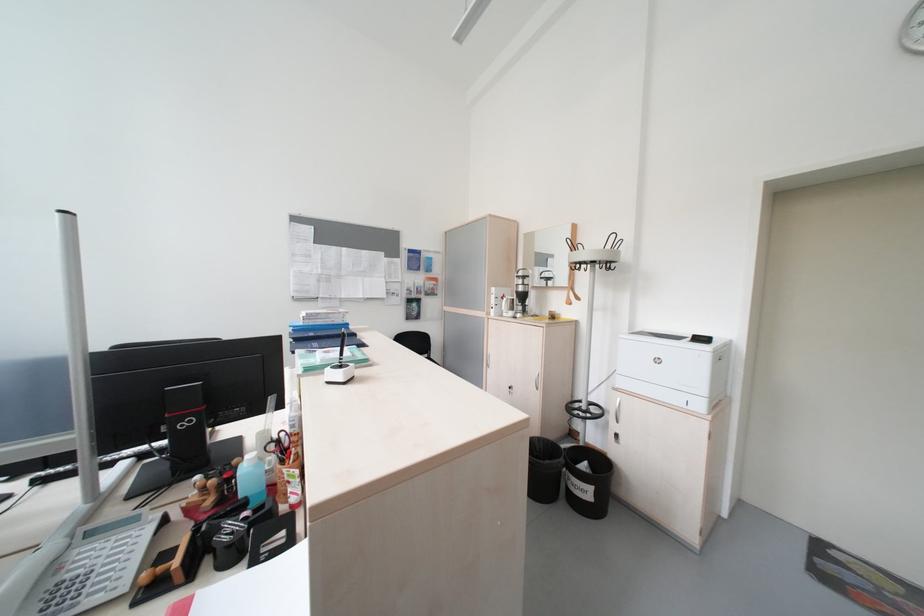
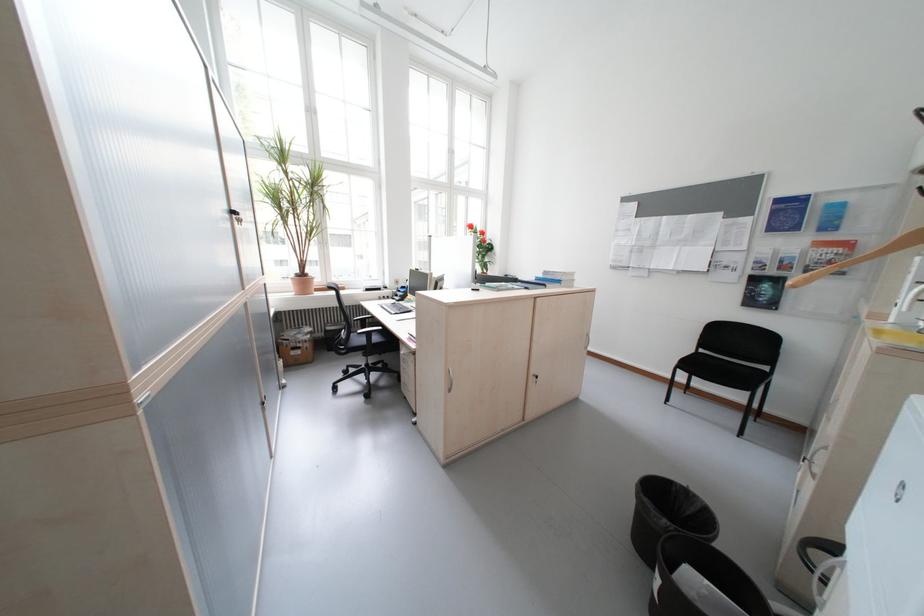
In the second image, find the point that corresponds to point 429,302 in the first image.

(788, 282)